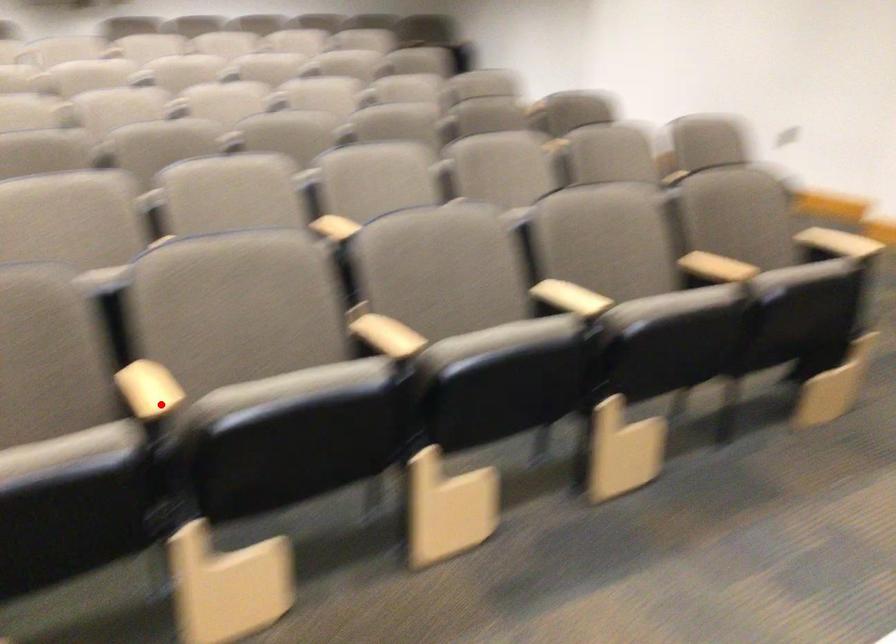
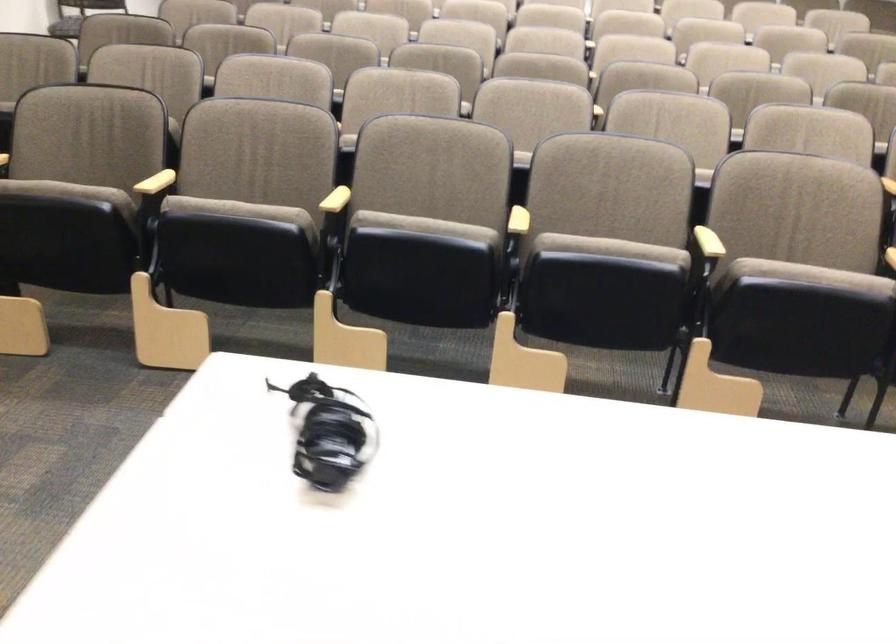
Question: A red point is marked in image1. In image2, is the corresponding 3D point closer to the camera or farther? Reply with the corresponding letter.

Choices:
 (A) The corresponding 3D point is closer.
 (B) The corresponding 3D point is farther.

Answer: (B)